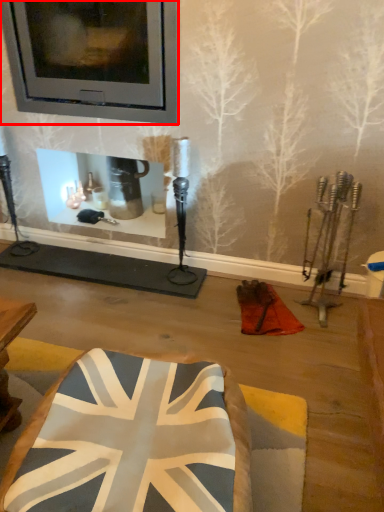
Question: Observing the image, what is the correct spatial positioning of picture frame (annotated by the red box) in reference to furniture?

Choices:
 (A) right
 (B) left

Answer: (B)